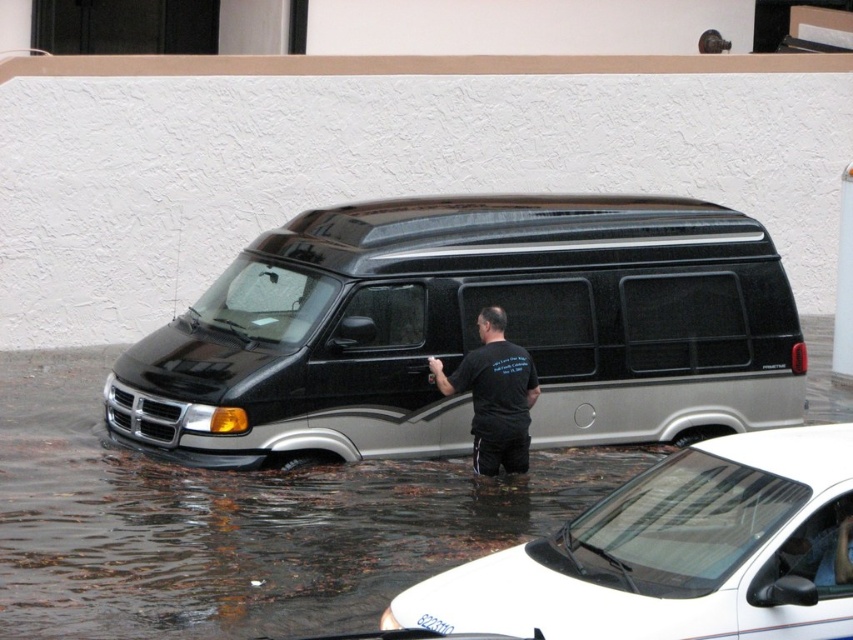
In the scene shown: You are a tow truck operator who needs to tow both the black metallic van at center and the white glossy car at lower center. Based on their sizes, which vehicle should you attach the tow hook to first?

The black metallic van at center is much taller than the white glossy car at lower center, so you should attach the tow hook to the black metallic van at center first to ensure stability during towing.

You are a driver trying to navigate through the flooded area. You see the white glossy car at lower center and the black matte shirt at center. Which object is wider in this scene?

The white glossy car at lower center might be wider than black matte shirt at center according to the description.